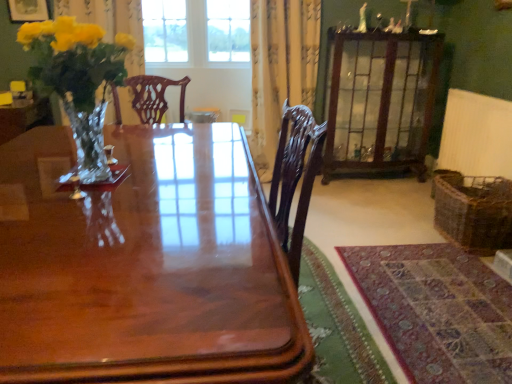
Question: Is matte gold picture frame at upper left bigger than glossy wood table at center?

Choices:
 (A) no
 (B) yes

Answer: (A)

Question: Is matte gold picture frame at upper left facing away from glossy wood table at center?

Choices:
 (A) no
 (B) yes

Answer: (A)

Question: Can you confirm if matte gold picture frame at upper left is wider than glossy wood table at center?

Choices:
 (A) yes
 (B) no

Answer: (B)

Question: From a real-world perspective, is matte gold picture frame at upper left on glossy wood table at center?

Choices:
 (A) yes
 (B) no

Answer: (A)

Question: Does matte gold picture frame at upper left lie behind glossy wood table at center?

Choices:
 (A) no
 (B) yes

Answer: (B)

Question: Considering their positions, is clear glass window at upper center located in front of or behind yellow floral-patterned curtain at upper center?

Choices:
 (A) front
 (B) behind

Answer: (B)

Question: Looking at the image, does clear glass window at upper center seem bigger or smaller compared to yellow floral-patterned curtain at upper center?

Choices:
 (A) small
 (B) big

Answer: (A)

Question: From the image's perspective, is clear glass window at upper center located above or below yellow floral-patterned curtain at upper center?

Choices:
 (A) above
 (B) below

Answer: (A)

Question: From their relative heights in the image, would you say clear glass window at upper center is taller or shorter than yellow floral-patterned curtain at upper center?

Choices:
 (A) short
 (B) tall

Answer: (A)

Question: Is wooden glass cabinet at upper right situated inside yellow floral-patterned curtain at upper center or outside?

Choices:
 (A) outside
 (B) inside

Answer: (A)

Question: Is wooden glass cabinet at upper right wider or thinner than yellow floral-patterned curtain at upper center?

Choices:
 (A) thin
 (B) wide

Answer: (B)

Question: In terms of size, does wooden glass cabinet at upper right appear bigger or smaller than yellow floral-patterned curtain at upper center?

Choices:
 (A) small
 (B) big

Answer: (B)

Question: From a real-world perspective, is wooden glass cabinet at upper right above or below yellow floral-patterned curtain at upper center?

Choices:
 (A) below
 (B) above

Answer: (A)

Question: Considering the positions of shiny glass vase with yellow flowers at left and clear glass window at upper center in the image, is shiny glass vase with yellow flowers at left bigger or smaller than clear glass window at upper center?

Choices:
 (A) big
 (B) small

Answer: (B)

Question: Is shiny glass vase with yellow flowers at left inside or outside of clear glass window at upper center?

Choices:
 (A) outside
 (B) inside

Answer: (A)